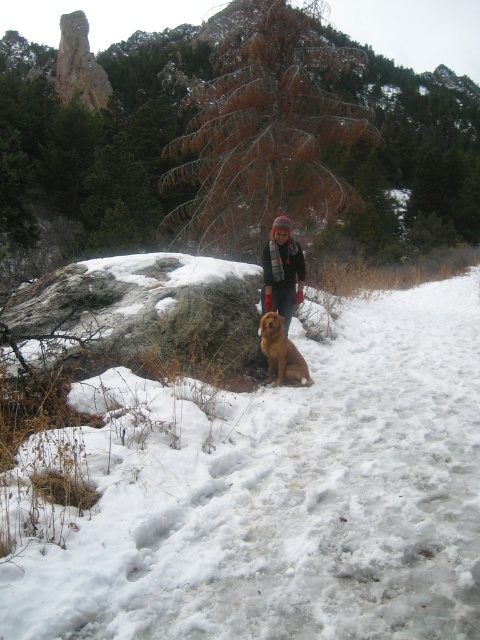
You are standing at the center of the image and want to place a small red flag exactly where the white fluffy snow at center is located. According to the coordinates provided, where should you place the flag?

You should place the flag at the coordinates point [280,496] where the white fluffy snow at center is located.

You are a photographer trying to capture the knitted wool hat at center in the image. What are the coordinates where you should focus your camera?

The knitted wool hat at center is located at coordinates point (x=282, y=272), so you should focus your camera there.

You are standing in the winter scene and want to take a closer look at the knitted wool hat at center. If you walk directly toward it, how far will you have to walk?

The knitted wool hat at center is 7.22 meters away from the viewer, so you will have to walk 7.22 meters to reach it.